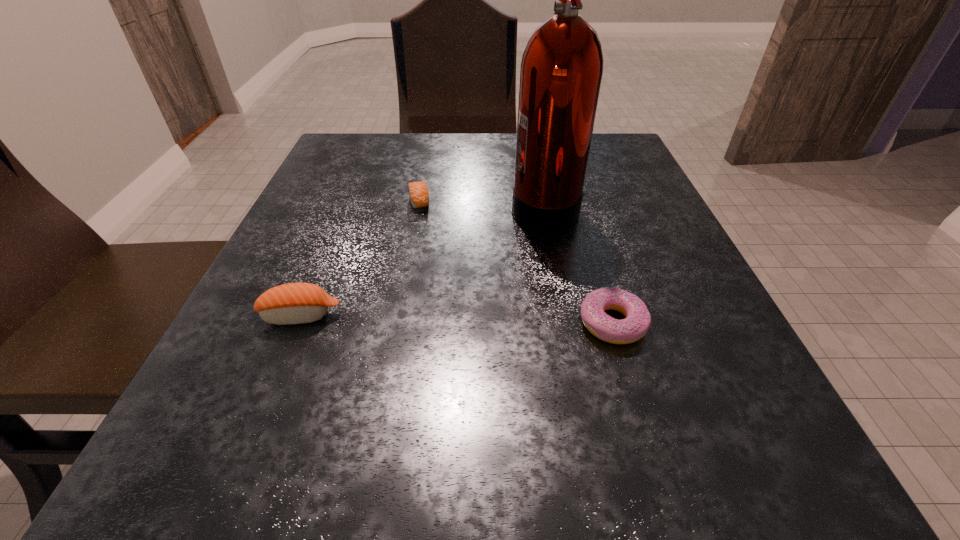
The image size is (960, 540). Find the location of `fire extinguisher`. fire extinguisher is located at coordinates (562, 66).

At what (x,y) coordinates should I click in order to perform the action: click on the second tallest object. Please return your answer as a coordinate pair (x, y). The image size is (960, 540). Looking at the image, I should click on (295, 303).

Locate an element on the screen. The image size is (960, 540). the left sushi is located at coordinates (295, 303).

The image size is (960, 540). I want to click on doughnut, so click(638, 319).

This screenshot has width=960, height=540. In order to click on the farther sushi in this screenshot , I will do `click(418, 191)`.

This screenshot has height=540, width=960. I want to click on the right sushi, so click(418, 191).

Find the location of `vacant space situated on the front-facing side of the fire extinguisher`. vacant space situated on the front-facing side of the fire extinguisher is located at coordinates (358, 205).

Identify the location of vacant region located on the front-facing side of the fire extinguisher. This screenshot has height=540, width=960. (307, 205).

The image size is (960, 540). I want to click on vacant space located 0.350m on the front-facing side of the fire extinguisher, so click(x=332, y=205).

Locate an element on the screen. This screenshot has width=960, height=540. free space located 0.110m on the right of the left sushi is located at coordinates pyautogui.click(x=416, y=316).